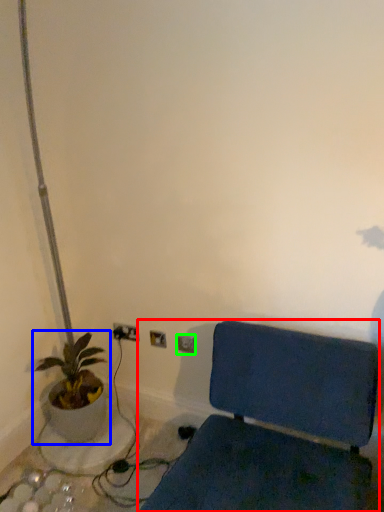
Question: Considering the real-world distances, which object is farthest from furniture (highlighted by a red box)? houseplant (highlighted by a blue box) or electric outlet (highlighted by a green box)?

Choices:
 (A) houseplant
 (B) electric outlet

Answer: (A)